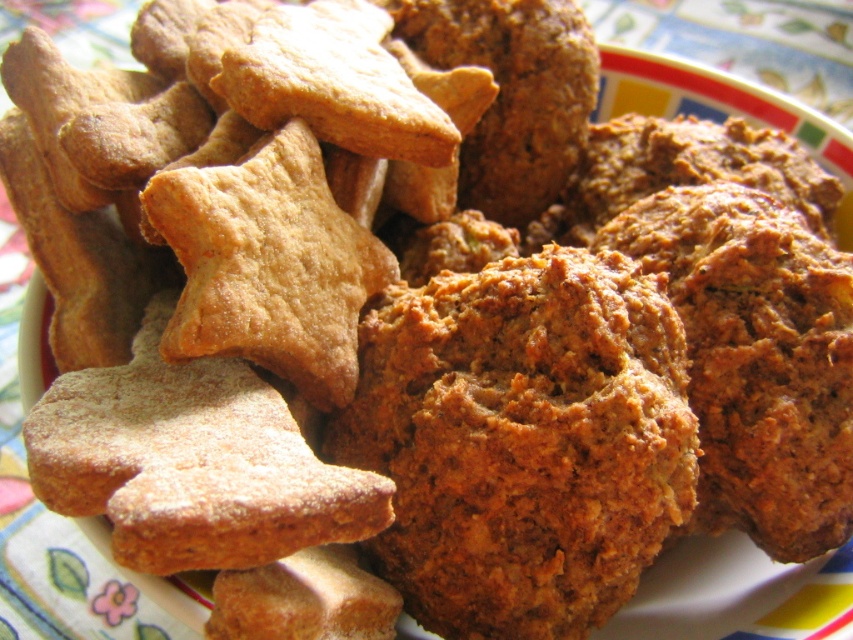
Question: Can you confirm if brown crumbly muffin at center is positioned to the left of slightly browned dough at center?

Choices:
 (A) no
 (B) yes

Answer: (A)

Question: Is brown crumbly muffin at center below slightly browned dough at center?

Choices:
 (A) no
 (B) yes

Answer: (B)

Question: Which point is closer to the camera?

Choices:
 (A) brown crumbly muffin at center
 (B) slightly browned dough at center

Answer: (B)

Question: From the image, what is the correct spatial relationship of brown crumbly muffin at center in relation to slightly browned dough at center?

Choices:
 (A) left
 (B) right

Answer: (B)

Question: Which point is farther to the camera?

Choices:
 (A) brown crumbly muffin at center
 (B) slightly browned dough at center

Answer: (A)

Question: Among these objects, which one is nearest to the camera?

Choices:
 (A) brown crumbly muffin at center
 (B) slightly browned dough at center

Answer: (B)